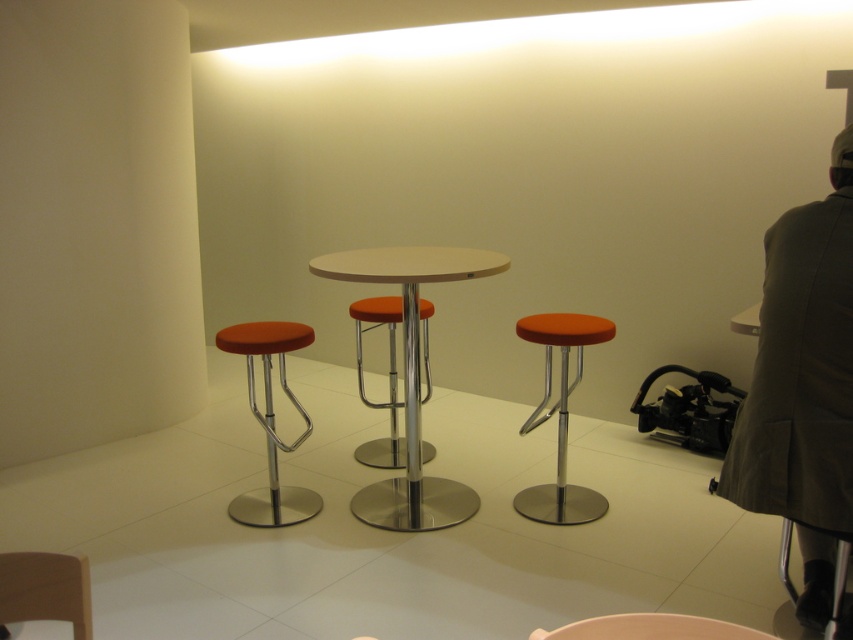
You are a customer sitting at the round table in the minimalist indoor setting. You notice two stools at the center. Which stool is positioned higher up, the orange fabric stool at center or the matte orange stool at center?

The orange fabric stool at center is located above the matte orange stool at center, so it is positioned higher up.

Consider the image. You are sitting at the round table in the center of the room and notice two stools at center. Which one is more to your right, the orange fabric stool at center or the matte orange stool at center?

The orange fabric stool at center is more to your right because it is positioned on the right side of the matte orange stool at center.